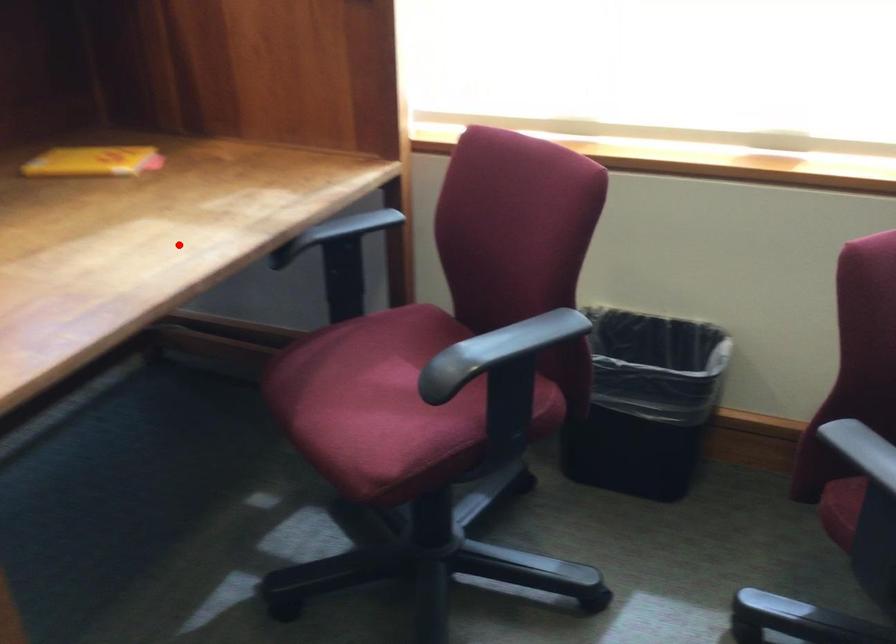
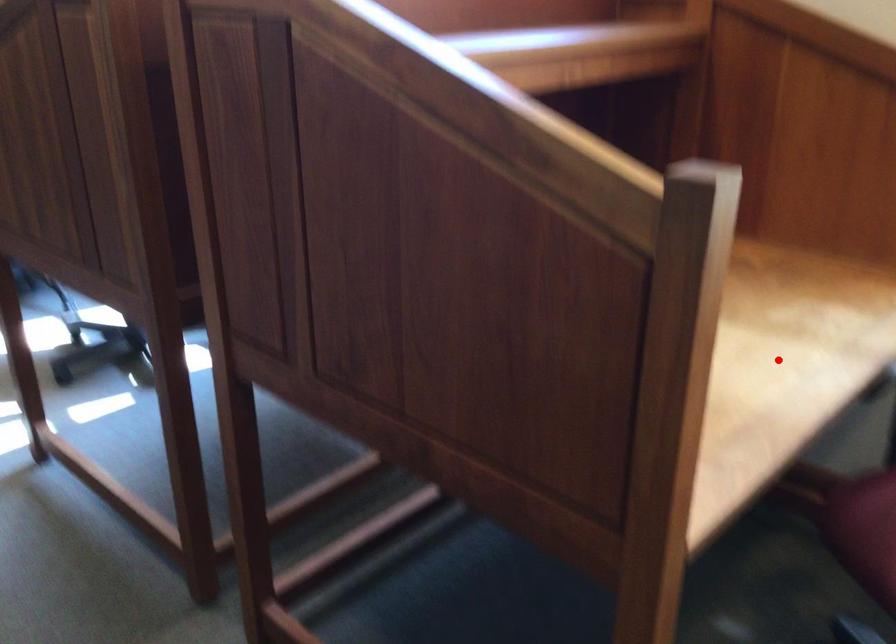
I am providing you with two images of the same scene from different viewpoints. A red point is marked on the first image and another point is marked on the second image. Are the points marked in image1 and image2 representing the same 3D position?

Yes